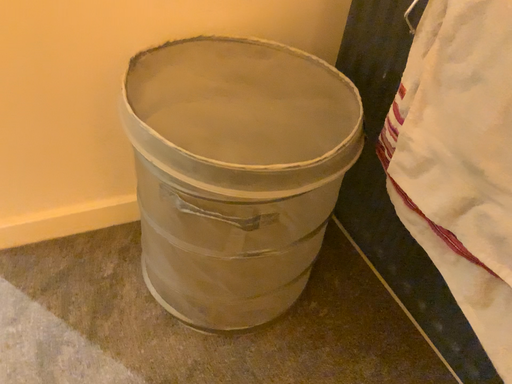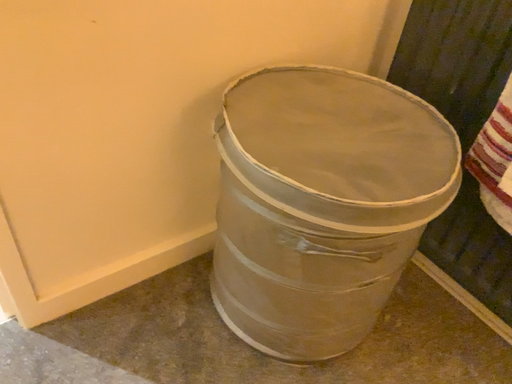
Question: Which way did the camera rotate in the video?

Choices:
 (A) rotated left
 (B) rotated right

Answer: (B)